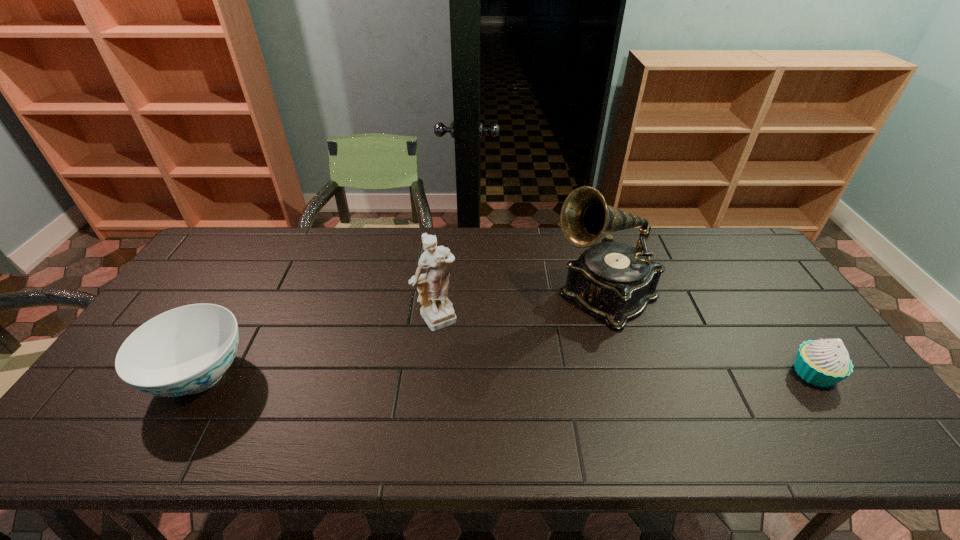
Where is `chinaware`? chinaware is located at coordinates (186, 350).

Where is `the rightmost object`? the rightmost object is located at coordinates (823, 363).

You are a GUI agent. You are given a task and a screenshot of the screen. Output one action in this format:
    pyautogui.click(x=<x>, y=<y>)
    Task: Click on the third object from right to left
    The height and width of the screenshot is (540, 960).
    Given the screenshot: What is the action you would take?
    pyautogui.click(x=437, y=310)

The image size is (960, 540). I want to click on the second tallest object, so click(x=437, y=310).

You are a GUI agent. You are given a task and a screenshot of the screen. Output one action in this format:
    pyautogui.click(x=<x>, y=<y>)
    Task: Click on the phonograph record
    
    Given the screenshot: What is the action you would take?
    pyautogui.click(x=614, y=281)

Image resolution: width=960 pixels, height=540 pixels. What are the coordinates of `the tallest object` in the screenshot? It's located at (614, 281).

The image size is (960, 540). In order to click on vacant space situated 0.100m on the right of the leftmost object in this screenshot , I will do `click(291, 375)`.

Image resolution: width=960 pixels, height=540 pixels. In order to click on free spot located on the left of the rightmost object in this screenshot , I will do `click(705, 373)`.

What are the coordinates of `blank space located on the front-facing side of the third shortest object` in the screenshot? It's located at (468, 352).

What are the coordinates of `vacant region located on the front-facing side of the third shortest object` in the screenshot? It's located at (487, 375).